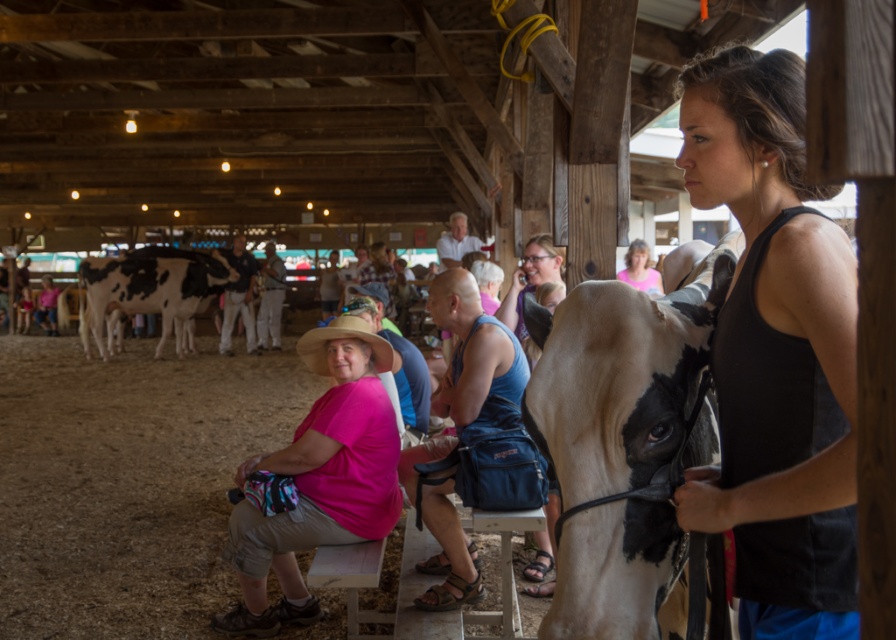
You are a farmer who needs to determine which cow is shorter between the white glossy cow at center and the white and black spotted cow at left. Based on the scene description, which cow is shorter?

The white glossy cow at center is shorter than the white and black spotted cow at left.

You are standing in the barn and want to take a photo of both point (596, 364) and point (213, 257). Which point should you focus on first to ensure both are in clear view?

You should focus on point (596, 364) first because it is closer to the camera than point (213, 257), allowing both points to be in focus when using depth of field.